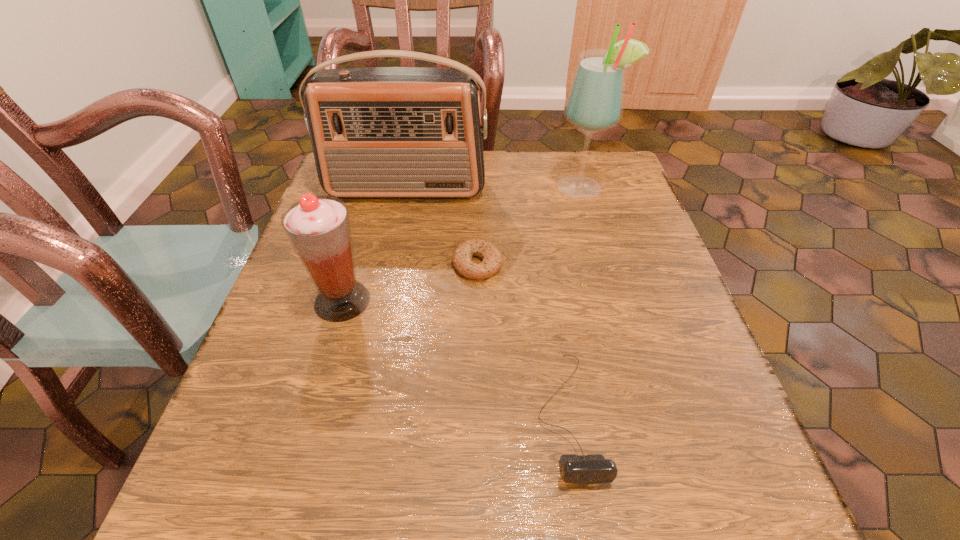
Where is `blank region between the fourth shortest object and the third tallest object`? blank region between the fourth shortest object and the third tallest object is located at coordinates (374, 245).

You are a GUI agent. You are given a task and a screenshot of the screen. Output one action in this format:
    pyautogui.click(x=<x>, y=<y>)
    Task: Click on the free space that is in between the shortest object and the rightmost object
    This screenshot has height=540, width=960.
    Given the screenshot: What is the action you would take?
    pyautogui.click(x=530, y=226)

Find the location of `free point between the radio receiver and the nearest object`. free point between the radio receiver and the nearest object is located at coordinates (487, 302).

Identify the location of empty location between the smoothie and the radio receiver. The image size is (960, 540). (374, 245).

At what (x,y) coordinates should I click in order to perform the action: click on unoccupied area between the radio receiver and the third shortest object. Please return your answer as a coordinate pair (x, y). Looking at the image, I should click on (374, 245).

You are a GUI agent. You are given a task and a screenshot of the screen. Output one action in this format:
    pyautogui.click(x=<x>, y=<y>)
    Task: Click on the object that can be found as the third closest to the bagel
    The width and height of the screenshot is (960, 540).
    Given the screenshot: What is the action you would take?
    pyautogui.click(x=592, y=468)

Find the location of `object that is the third closest one to the bagel`. object that is the third closest one to the bagel is located at coordinates (592, 468).

What are the coordinates of `free space that satisfies the following two spatial constraints: 1. on the back side of the third tallest object; 2. on the right side of the alcohol` in the screenshot? It's located at (375, 188).